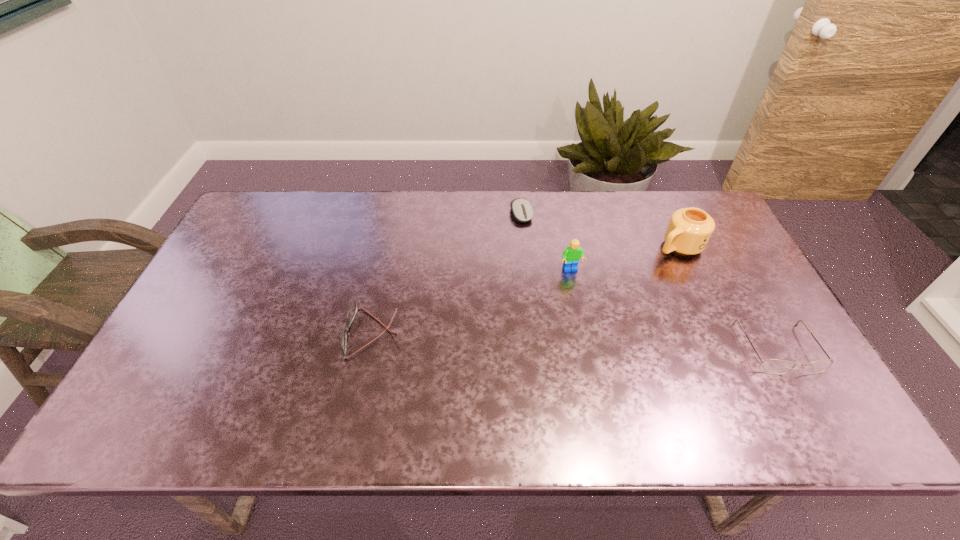
The height and width of the screenshot is (540, 960). Identify the location of the left spectacles. (353, 308).

This screenshot has height=540, width=960. Identify the location of the right spectacles. (771, 366).

Where is `the farthest object`? The image size is (960, 540). the farthest object is located at coordinates (522, 210).

Image resolution: width=960 pixels, height=540 pixels. Identify the location of computer equipment. (522, 210).

Image resolution: width=960 pixels, height=540 pixels. In order to click on the second farthest object in this screenshot , I will do `click(689, 230)`.

Identify the location of Lego. The image size is (960, 540). (571, 255).

Where is `the third nearest object`? Image resolution: width=960 pixels, height=540 pixels. the third nearest object is located at coordinates (571, 255).

At what (x,y) coordinates should I click in order to perform the action: click on vacant space located on the front-facing side of the left spectacles. Please return your answer as a coordinate pair (x, y). This screenshot has height=540, width=960. Looking at the image, I should click on (206, 333).

Image resolution: width=960 pixels, height=540 pixels. Identify the location of blank space located on the front-facing side of the left spectacles. [233, 333].

Locate an element on the screen. vacant space situated 0.310m on the front-facing side of the left spectacles is located at coordinates (226, 333).